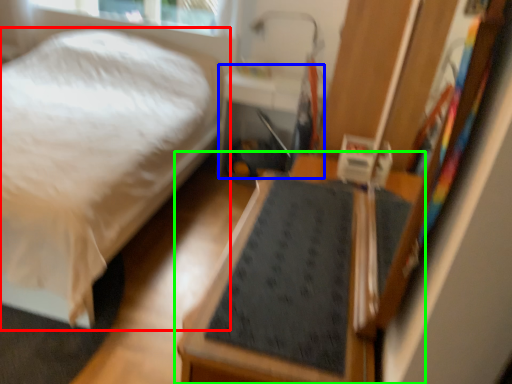
Question: Estimate the real-world distances between objects in this image. Which object is closer to bed (highlighted by a red box), table (highlighted by a blue box) or furniture (highlighted by a green box)?

Choices:
 (A) table
 (B) furniture

Answer: (A)